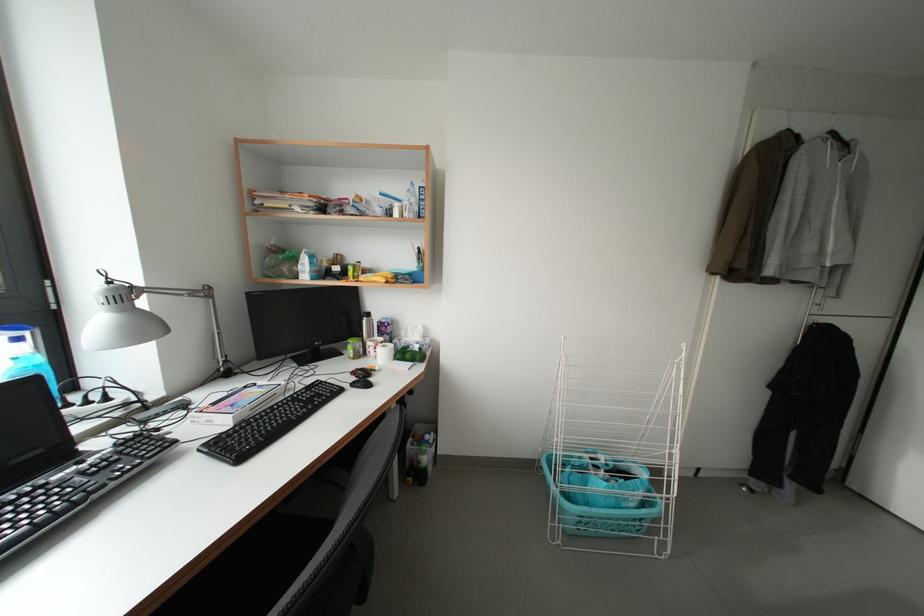
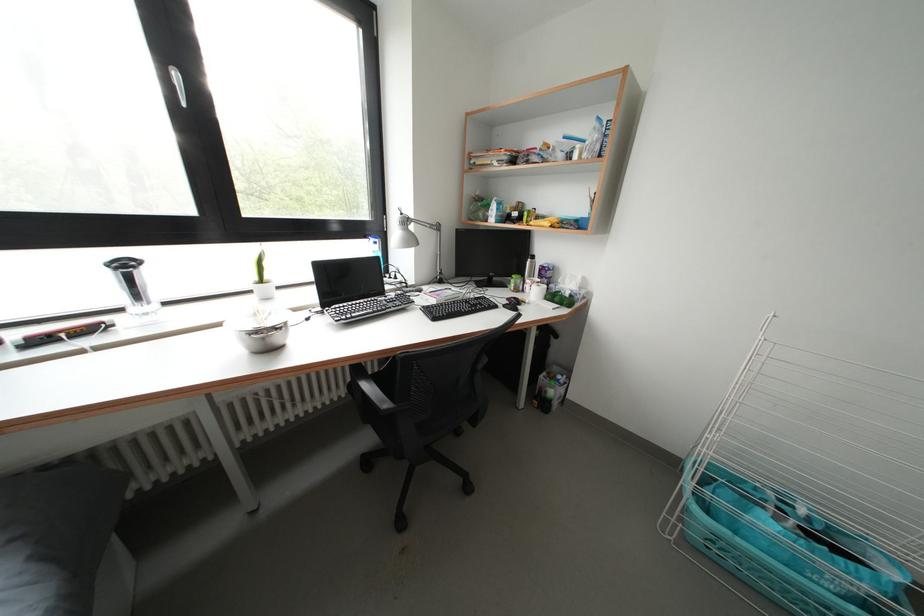
In the second image, find the point that corresponds to [377,349] in the first image.

(535, 286)